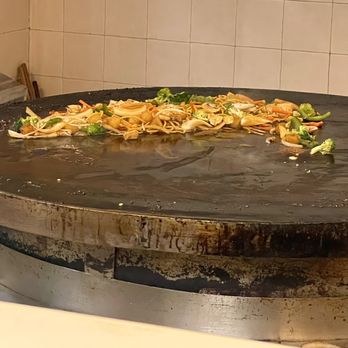
In order to click on grout in this screenshot , I will do `click(236, 50)`, `click(328, 79)`, `click(146, 45)`, `click(128, 38)`.